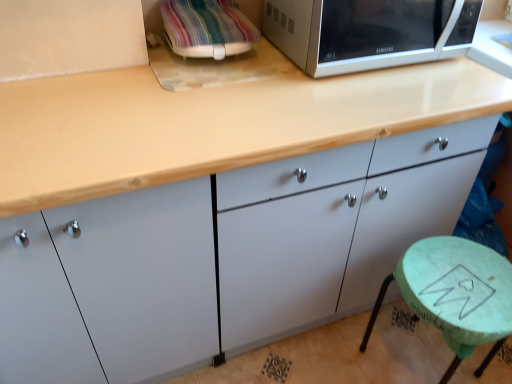
The image size is (512, 384). Find the location of `empty space that is ontop of matte white cabinet at center (from a real-world perspective)`. empty space that is ontop of matte white cabinet at center (from a real-world perspective) is located at coordinates (201, 95).